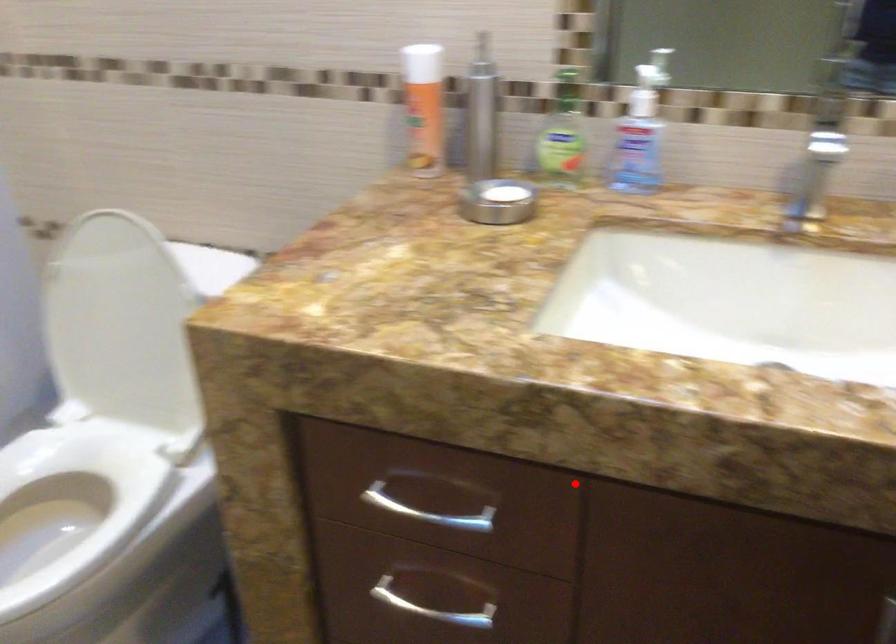
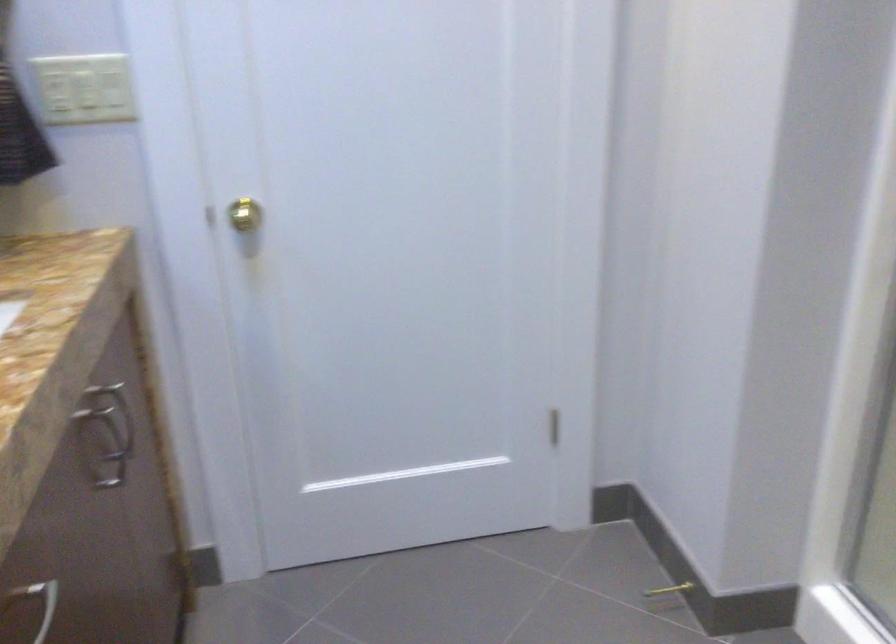
Locate, in the second image, the point that corresponds to the highlighted location in the first image.

(37, 603)